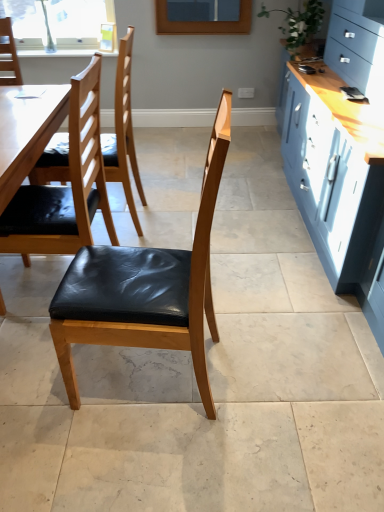
Locate an element on the screen. vacant space underneath matte black leather chair at center, the 1th chair from the front (from a real-world perspective) is located at coordinates (144, 375).